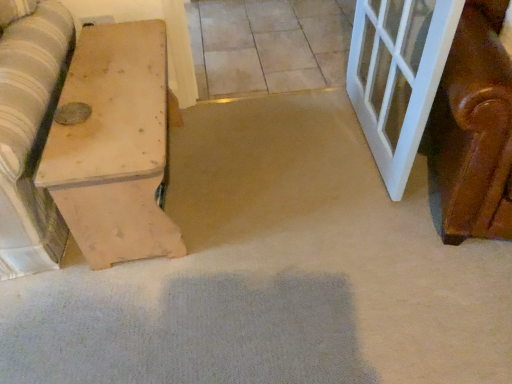
Where is `free location above light brown wood chest at left (from a real-world perspective)`? free location above light brown wood chest at left (from a real-world perspective) is located at coordinates point(111,91).